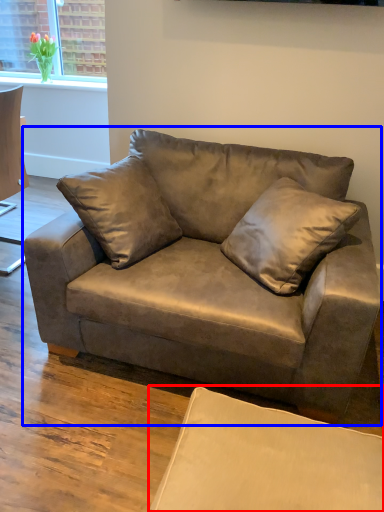
Question: Which of the following is the farthest to the observer, swivel chair (highlighted by a red box) or studio couch (highlighted by a blue box)?

Choices:
 (A) swivel chair
 (B) studio couch

Answer: (B)